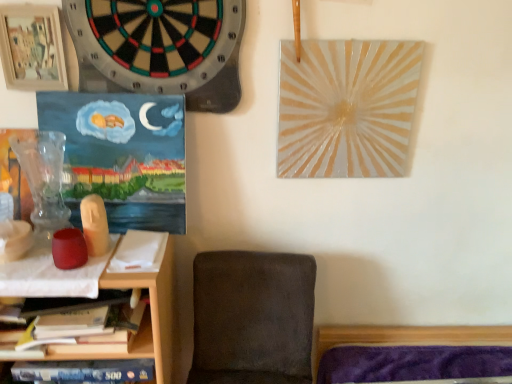
Question: From the image's perspective, does wooden picture frame at upper left appear lower than black felt dartboard at upper left?

Choices:
 (A) yes
 (B) no

Answer: (B)

Question: Considering the relative sizes of wooden picture frame at upper left and black felt dartboard at upper left in the image provided, is wooden picture frame at upper left thinner than black felt dartboard at upper left?

Choices:
 (A) no
 (B) yes

Answer: (B)

Question: Can you confirm if wooden picture frame at upper left is smaller than black felt dartboard at upper left?

Choices:
 (A) yes
 (B) no

Answer: (A)

Question: Is the position of wooden picture frame at upper left more distant than that of black felt dartboard at upper left?

Choices:
 (A) no
 (B) yes

Answer: (B)

Question: Is wooden picture frame at upper left wider than black felt dartboard at upper left?

Choices:
 (A) yes
 (B) no

Answer: (B)

Question: In terms of width, does wooden picture frame at upper left look wider or thinner when compared to wooden shelf at lower left?

Choices:
 (A) wide
 (B) thin

Answer: (B)

Question: Is wooden picture frame at upper left situated inside wooden shelf at lower left or outside?

Choices:
 (A) outside
 (B) inside

Answer: (A)

Question: Is wooden picture frame at upper left taller or shorter than wooden shelf at lower left?

Choices:
 (A) short
 (B) tall

Answer: (A)

Question: Based on their positions, is wooden picture frame at upper left located to the left or right of wooden shelf at lower left?

Choices:
 (A) left
 (B) right

Answer: (B)

Question: Which is correct: wooden picture frame at upper left is inside dark gray fabric chair at lower center, or outside of it?

Choices:
 (A) outside
 (B) inside

Answer: (A)

Question: From a real-world perspective, relative to dark gray fabric chair at lower center, is wooden picture frame at upper left vertically above or below?

Choices:
 (A) below
 (B) above

Answer: (B)

Question: From the image's perspective, is wooden picture frame at upper left positioned above or below dark gray fabric chair at lower center?

Choices:
 (A) below
 (B) above

Answer: (B)

Question: Looking at the image, does wooden picture frame at upper left seem bigger or smaller compared to dark gray fabric chair at lower center?

Choices:
 (A) small
 (B) big

Answer: (A)

Question: Is black felt dartboard at upper left spatially inside wooden shelf at lower left, or outside of it?

Choices:
 (A) inside
 (B) outside

Answer: (B)

Question: Looking at the image, does black felt dartboard at upper left seem bigger or smaller compared to wooden shelf at lower left?

Choices:
 (A) big
 (B) small

Answer: (B)